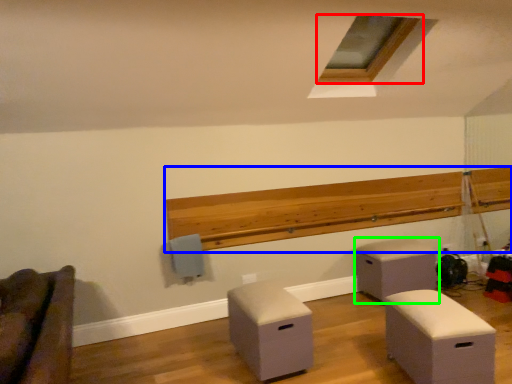
Question: Estimate the real-world distances between objects in this image. Which object is farther from window (highlighted by a red box), ledge (highlighted by a blue box) or furniture (highlighted by a green box)?

Choices:
 (A) ledge
 (B) furniture

Answer: (B)